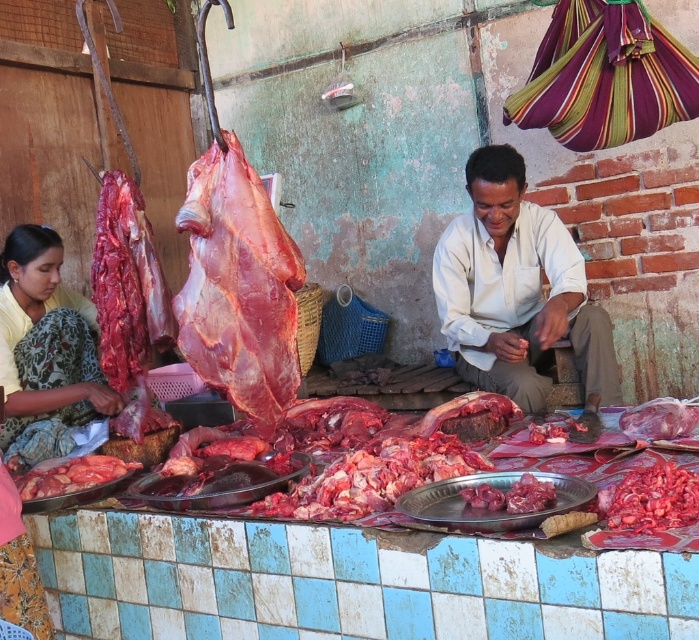
Question: Can you confirm if white matte shirt at center is thinner than yellow fabric saree at left?

Choices:
 (A) no
 (B) yes

Answer: (A)

Question: Among these points, which one is nearest to the camera?

Choices:
 (A) (50, 364)
 (B) (500, 296)

Answer: (A)

Question: Does white matte shirt at center come behind yellow fabric saree at left?

Choices:
 (A) no
 (B) yes

Answer: (A)

Question: Considering the relative positions of white matte shirt at center and yellow fabric saree at left in the image provided, where is white matte shirt at center located with respect to yellow fabric saree at left?

Choices:
 (A) below
 (B) above

Answer: (B)